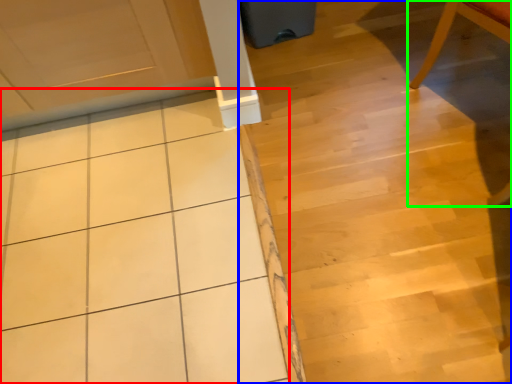
Question: Based on their relative distances, which object is farther from ceramic tile (highlighted by a red box)? Choose from stair (highlighted by a blue box) and chair (highlighted by a green box).

Choices:
 (A) stair
 (B) chair

Answer: (B)